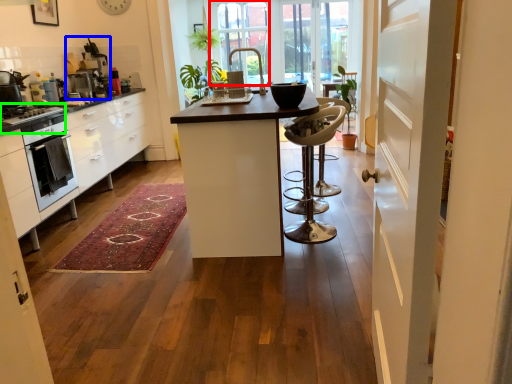
Question: Which object is positioned farthest from window (highlighted by a red box)? Select from appliance (highlighted by a blue box) and stove (highlighted by a green box).

Choices:
 (A) appliance
 (B) stove

Answer: (B)